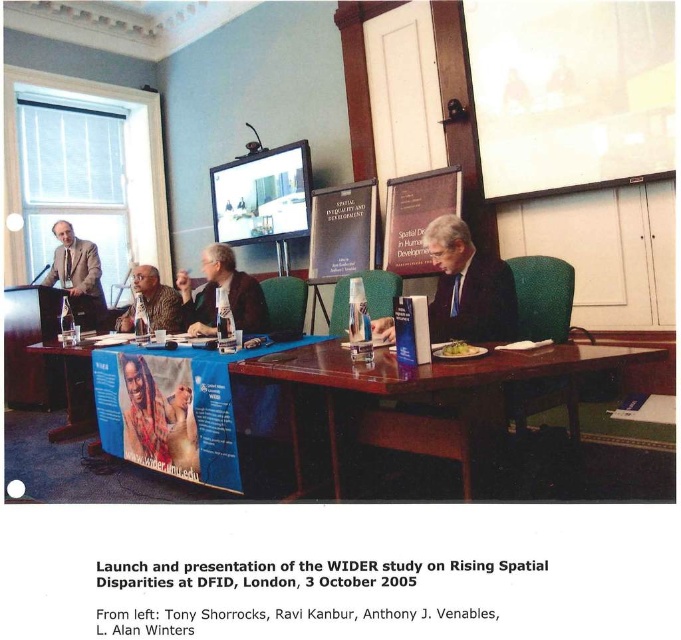
Question: Is matte paper banner at center further to camera compared to matte black laptop at center?

Choices:
 (A) no
 (B) yes

Answer: (B)

Question: Which point is closer to the camera?

Choices:
 (A) (409, 269)
 (B) (244, 301)
 (C) (123, 387)

Answer: (C)

Question: Is glossy wood table at center bigger than light brown suit at left?

Choices:
 (A) yes
 (B) no

Answer: (A)

Question: Considering the real-world distances, which object is closest to the matte paper poster at center?

Choices:
 (A) wooden signboard at center
 (B) matte paper banner at center
 (C) glossy wood table at center

Answer: (B)

Question: Is wooden signboard at center to the right of light brown suit at left from the viewer's perspective?

Choices:
 (A) no
 (B) yes

Answer: (B)

Question: Which of the following is the farthest from the observer?

Choices:
 (A) matte paper banner at center
 (B) matte black jacket at center
 (C) wooden signboard at center

Answer: (A)